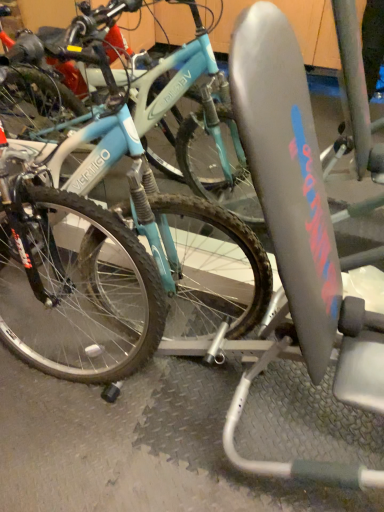
Locate an element on the screen. The width and height of the screenshot is (384, 512). matte blue bicycle at center is located at coordinates (148, 164).

What do you see at coordinates (148, 164) in the screenshot?
I see `matte blue bicycle at center` at bounding box center [148, 164].

You are a GUI agent. You are given a task and a screenshot of the screen. Output one action in this format:
    pyautogui.click(x=<x>, y=<y>)
    Task: Click on the matte blue bicycle at center
    The image size is (384, 512).
    Given the screenshot: What is the action you would take?
    pyautogui.click(x=148, y=164)